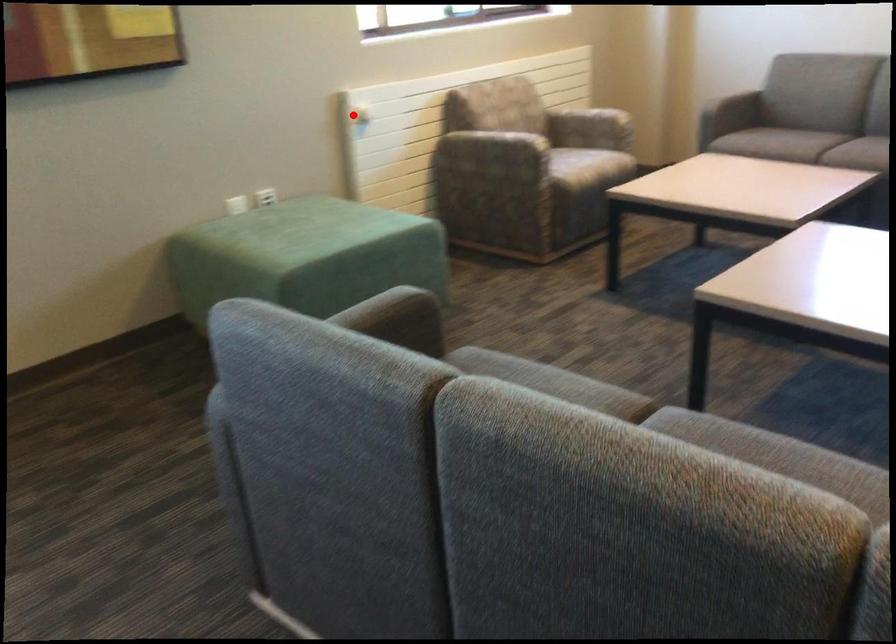
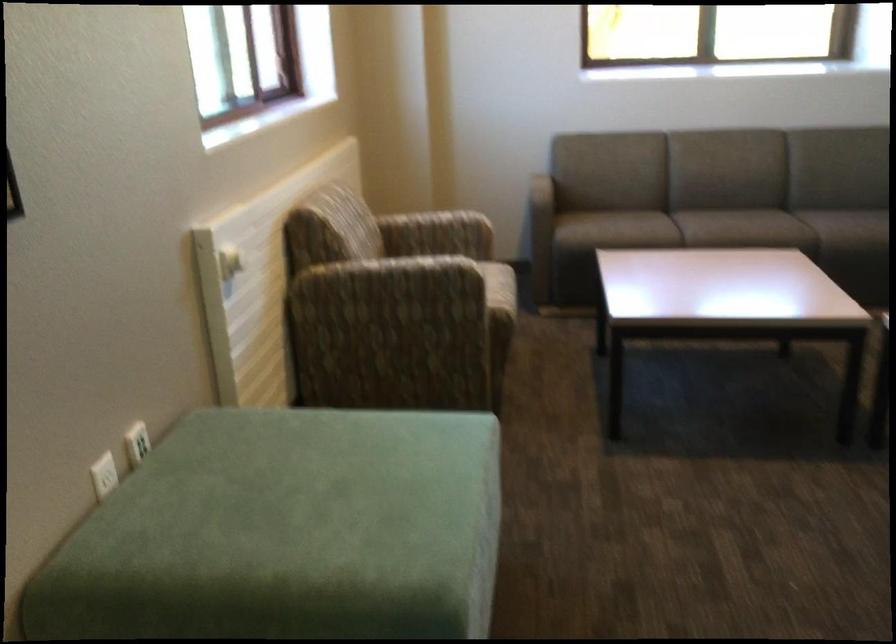
Where in the second image is the point corresponding to the highlighted location from the first image?

(229, 263)